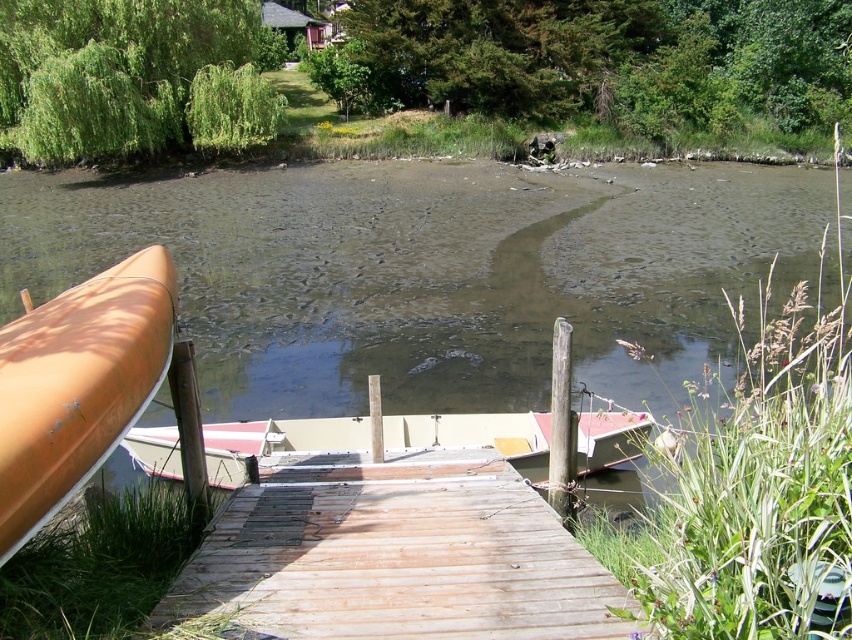
You are planning to bring both the wooden dock at center and the matte orange canoe at left onto a truck for transport. The truck bed has a width of 3 meters. Can both items be placed side by side without exceeding the truck bed width?

The wooden dock at center is wider than the matte orange canoe at left. However, since the exact widths are not provided, it is impossible to determine if their combined width exceeds 3 meters. More information is needed.

You are standing on the wooden dock and see the brown murky water at center and the matte orange canoe at left. Which object is positioned to the right side of the other?

The brown murky water at center is to the left of the matte orange canoe at left, meaning the matte orange canoe at left is positioned to the right side of the brown murky water at center.